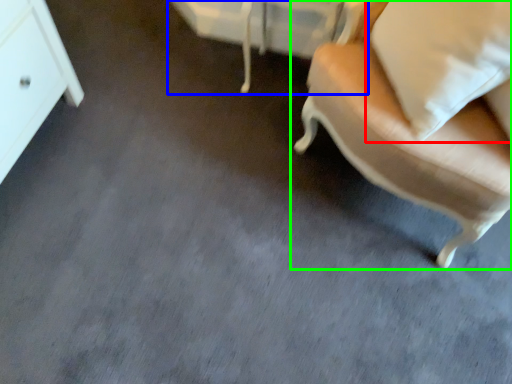
Question: Which object is positioned closest to pillow (highlighted by a red box)? Select from vanity (highlighted by a blue box) and chair (highlighted by a green box).

Choices:
 (A) vanity
 (B) chair

Answer: (B)